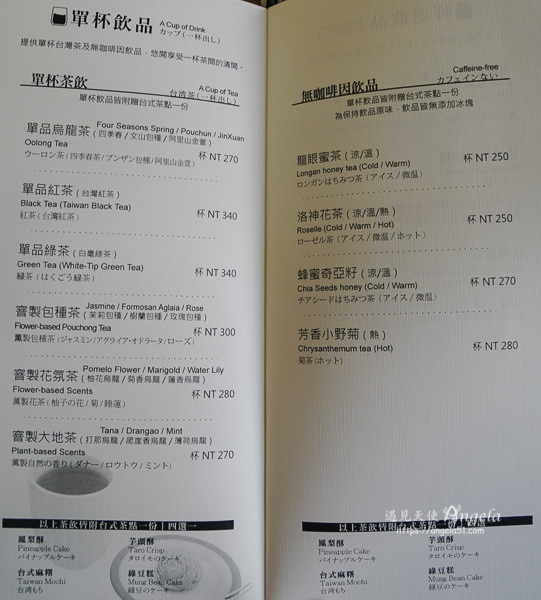
Where is `book`? book is located at coordinates (413, 448).